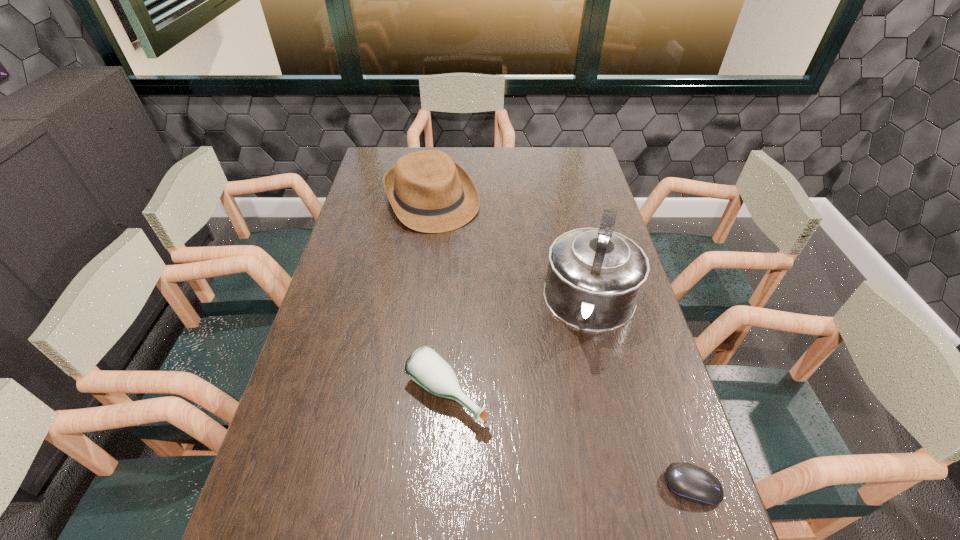
Identify the location of free location that satisfies the following two spatial constraints: 1. on the front side of the shortest object; 2. on the right side of the second farthest object. This screenshot has width=960, height=540. (634, 486).

Find the location of a particular element. Image resolution: width=960 pixels, height=540 pixels. free space that satisfies the following two spatial constraints: 1. on the front side of the computer mouse; 2. on the left side of the fedora is located at coordinates (395, 486).

This screenshot has height=540, width=960. In order to click on vacant point that satisfies the following two spatial constraints: 1. on the back side of the bottle; 2. on the right side of the tallest object in this screenshot , I will do `click(452, 306)`.